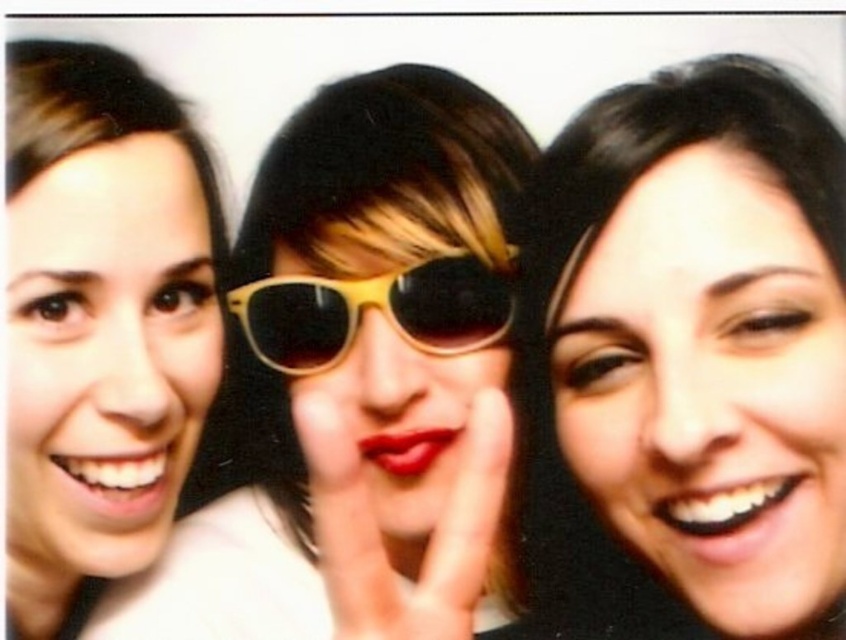
You are a photographer trying to adjust the spacing between the two sunglasses on the central person. The matte yellow sunglasses at center and the yellow plastic sunglasses at center are both on the same person. How far apart are they?

The matte yellow sunglasses at center is 9.46 centimeters away from the yellow plastic sunglasses at center.